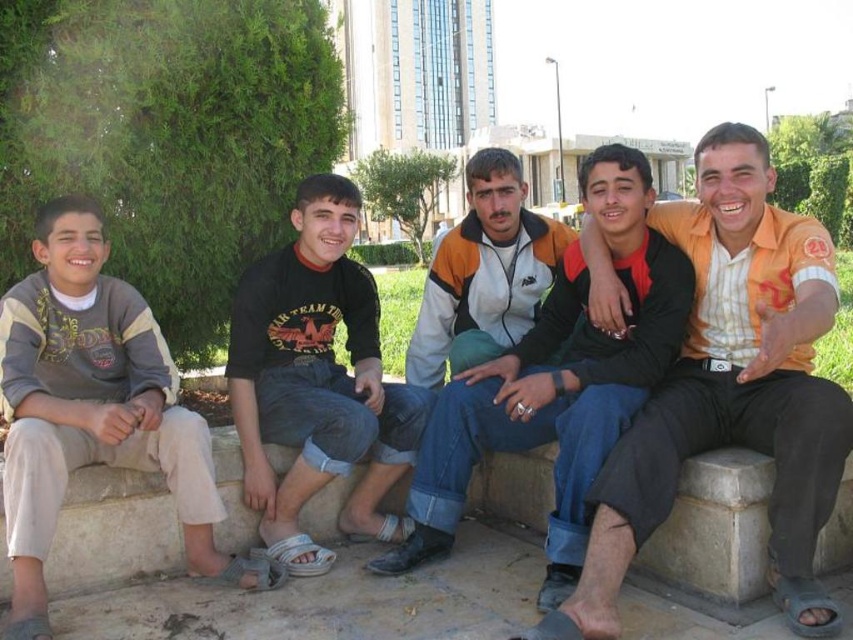
You are a photographer trying to capture a candid shot of the two central figures in the image. The orange striped shirt at center and the orange and white jacket at center are both in your frame. Considering their heights, which one is more likely to be obscured by the other when you take the photo?

The orange striped shirt at center is taller than the orange and white jacket at center, so it is more likely to obscure the latter in the photo.